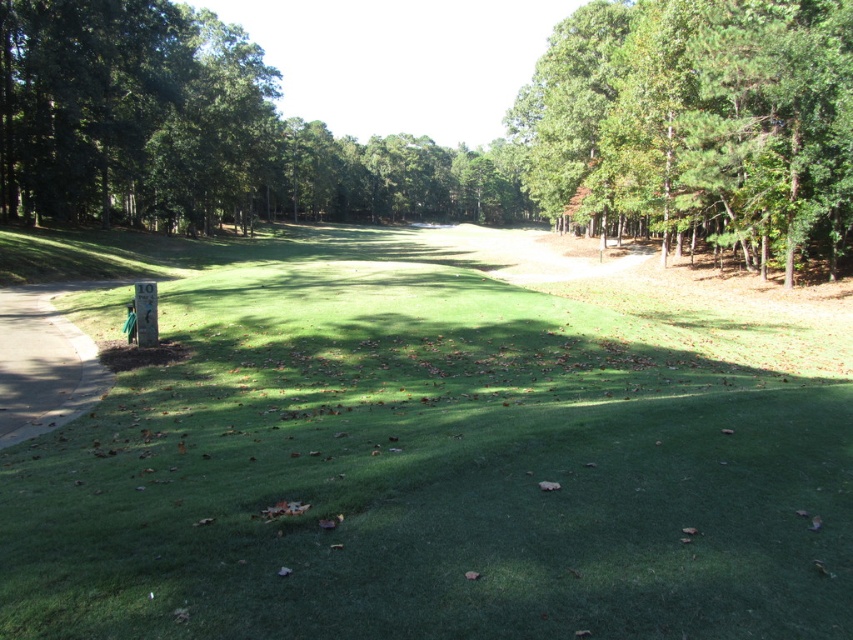
Question: Can you confirm if green turf at center is positioned to the left of concrete at left?

Choices:
 (A) no
 (B) yes

Answer: (A)

Question: Which object is closer to the camera taking this photo?

Choices:
 (A) green leafy trees at upper right
 (B) concrete at left

Answer: (B)

Question: Among these points, which one is nearest to the camera?

Choices:
 (A) (773, 125)
 (B) (193, 417)
 (C) (22, 355)

Answer: (B)

Question: Which of the following is the closest to the observer?

Choices:
 (A) green leafy trees at upper right
 (B) concrete at left

Answer: (B)

Question: From the image, what is the correct spatial relationship of green leafy trees at upper right in relation to concrete at left?

Choices:
 (A) above
 (B) below

Answer: (A)

Question: Does green turf at center appear over concrete at left?

Choices:
 (A) yes
 (B) no

Answer: (A)